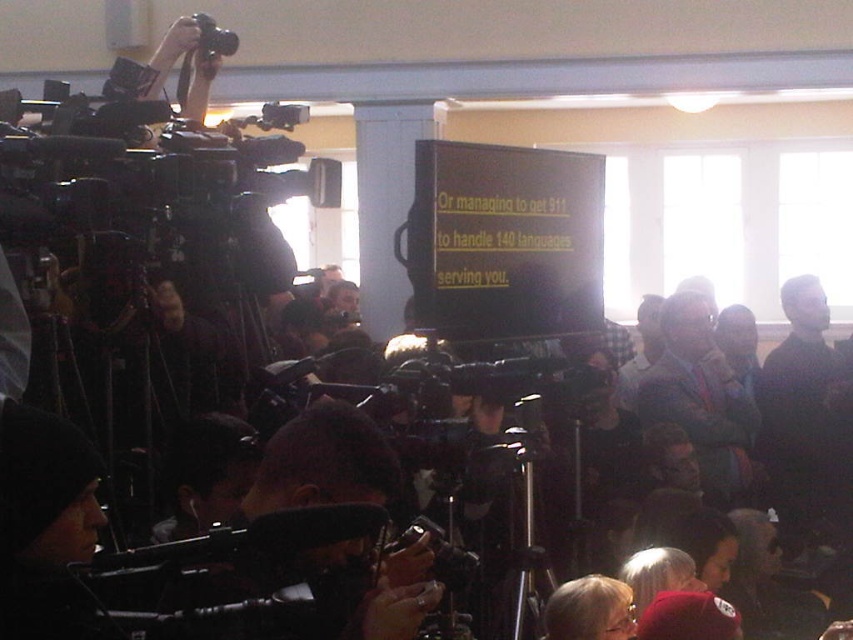
Between blonde hair at lower center and black plastic video camera at upper left, which one appears on the right side from the viewer's perspective?

blonde hair at lower center

Does blonde hair at lower center have a larger size compared to black plastic video camera at upper left?

Indeed, blonde hair at lower center has a larger size compared to black plastic video camera at upper left.

Between point (572, 637) and point (218, 51), which one is positioned in front?

Point (572, 637) is more forward.

Where is `blonde hair at lower center`? The width and height of the screenshot is (853, 640). blonde hair at lower center is located at coordinates (590, 609).

Can you confirm if blue fabric suit at center is smaller than black plastic video camera at upper left?

No.

Between point (686, 292) and point (207, 52), which one is positioned behind?

Point (686, 292)

I want to click on blue fabric suit at center, so click(701, 397).

Can you confirm if blue fabric suit at center is thinner than blonde hair at lower center?

Incorrect, blue fabric suit at center's width is not less than blonde hair at lower center's.

In the scene shown: Between blue fabric suit at center and blonde hair at lower center, which one has more height?

blue fabric suit at center

Looking at this image, measure the distance between point (737, 401) and camera.

Point (737, 401) and camera are 4.99 meters apart.

At what (x,y) coordinates should I click in order to perform the action: click on blue fabric suit at center. Please return your answer as a coordinate pair (x, y). This screenshot has width=853, height=640. Looking at the image, I should click on tap(701, 397).